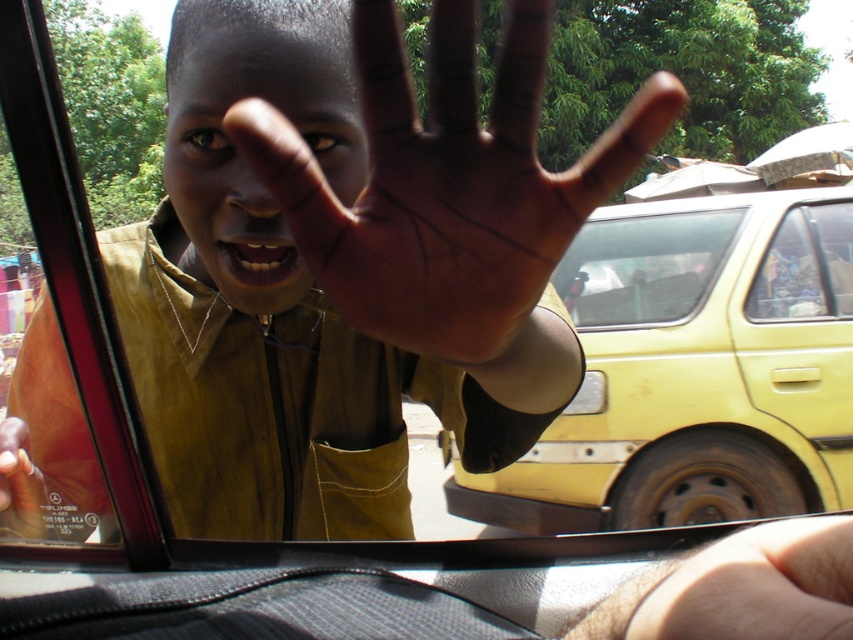
Which is in front, point (761, 632) or point (656, 252)?

Point (761, 632)

Is point (782, 541) closer to viewer compared to point (593, 316)?

Yes, point (782, 541) is in front of point (593, 316).

Find the location of `dry skin at center`. dry skin at center is located at coordinates (755, 586).

Does point (654, 218) lie behind point (724, 253)?

Yes.

Is point (659, 516) positioned before point (666, 317)?

Yes, it is in front of point (666, 317).

Find the location of a particular element. yellow matte car at center is located at coordinates (693, 371).

Between dark skin face at center and yellow matte car window at center, which one is positioned lower?

dark skin face at center is below.

Which is in front, point (198, 204) or point (639, 256)?

Positioned in front is point (198, 204).

At what (x,y) coordinates should I click in order to perform the action: click on dark skin face at center. Please return your answer as a coordinate pair (x, y). Looking at the image, I should click on (252, 150).